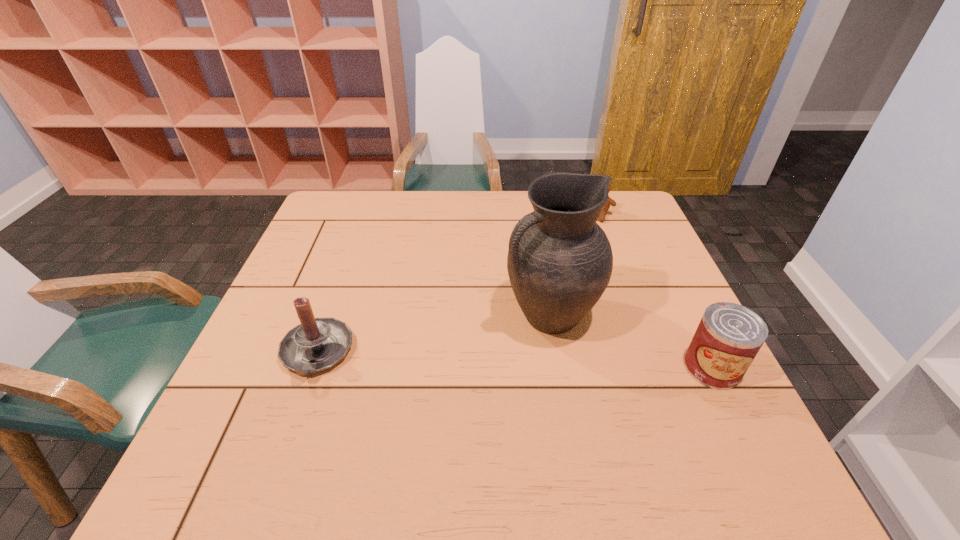
Locate an element on the screen. Image resolution: width=960 pixels, height=540 pixels. free space located on the front-facing side of the farthest object is located at coordinates (558, 289).

Find the location of `vacant region located on the side of the second object from left to right with the handle`. vacant region located on the side of the second object from left to right with the handle is located at coordinates (343, 415).

The width and height of the screenshot is (960, 540). I want to click on vacant space located on the side of the second object from left to right with the handle, so click(474, 352).

Locate an element on the screen. The image size is (960, 540). vacant space situated 0.110m on the side of the second object from left to right with the handle is located at coordinates (470, 354).

Identify the location of object at the far edge. This screenshot has height=540, width=960. (610, 201).

At what (x,y) coordinates should I click in order to perform the action: click on object that is at the left edge. Please return your answer as a coordinate pair (x, y). Looking at the image, I should click on (316, 344).

Where is `can that is at the right edge`? This screenshot has width=960, height=540. can that is at the right edge is located at coordinates (729, 336).

Locate an element on the screen. teddy bear that is at the right edge is located at coordinates [610, 201].

This screenshot has height=540, width=960. Find the location of `object present at the far right corner`. object present at the far right corner is located at coordinates (610, 201).

In the image, there is a desktop. Where is `vacant space at the far edge`? vacant space at the far edge is located at coordinates (472, 218).